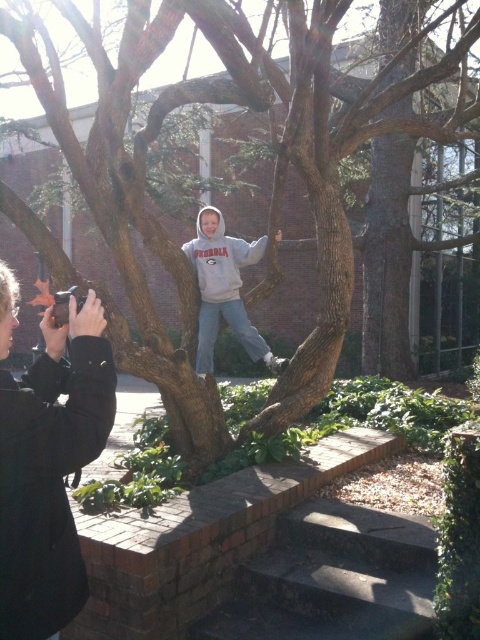
Measure the distance between point (9, 422) and camera.

1.36 meters

Does black fabric camera at lower left have a smaller size compared to gray fleece sweatshirt at center?

Correct, black fabric camera at lower left occupies less space than gray fleece sweatshirt at center.

The width and height of the screenshot is (480, 640). Describe the element at coordinates (49, 472) in the screenshot. I see `black fabric camera at lower left` at that location.

You are a GUI agent. You are given a task and a screenshot of the screen. Output one action in this format:
    pyautogui.click(x=<x>, y=<y>)
    Task: Click on the black fabric camera at lower left
    This screenshot has height=640, width=480.
    Given the screenshot: What is the action you would take?
    pyautogui.click(x=49, y=472)

Who is more forward, (x=12, y=531) or (x=386, y=516)?

Point (x=12, y=531) is more forward.

Consider the image. Is black fabric camera at lower left wider than dark gray concrete stairs at lower center?

No, black fabric camera at lower left is not wider than dark gray concrete stairs at lower center.

Locate an element on the screen. Image resolution: width=480 pixels, height=640 pixels. black fabric camera at lower left is located at coordinates (49, 472).

Between gray fleece hoodie at center and gray fleece sweatshirt at center, which one appears on the left side from the viewer's perspective?

gray fleece sweatshirt at center

Which of these two, gray fleece hoodie at center or gray fleece sweatshirt at center, stands taller?

gray fleece hoodie at center

You are a GUI agent. You are given a task and a screenshot of the screen. Output one action in this format:
    pyautogui.click(x=<x>, y=<y>)
    Task: Click on the gray fleece hoodie at center
    The height and width of the screenshot is (640, 480).
    Given the screenshot: What is the action you would take?
    pyautogui.click(x=224, y=289)

Locate an element on the screen. This screenshot has height=640, width=480. gray fleece hoodie at center is located at coordinates (224, 289).